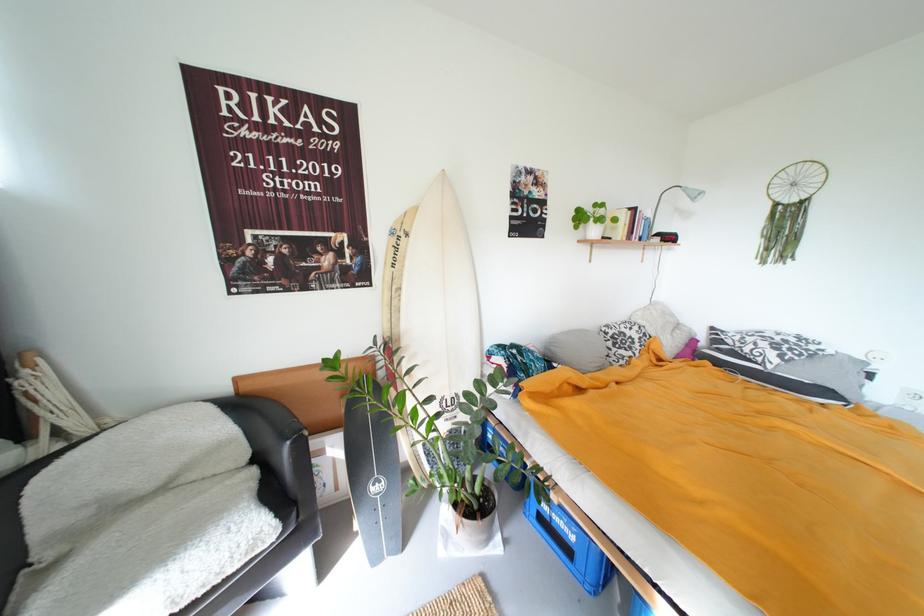
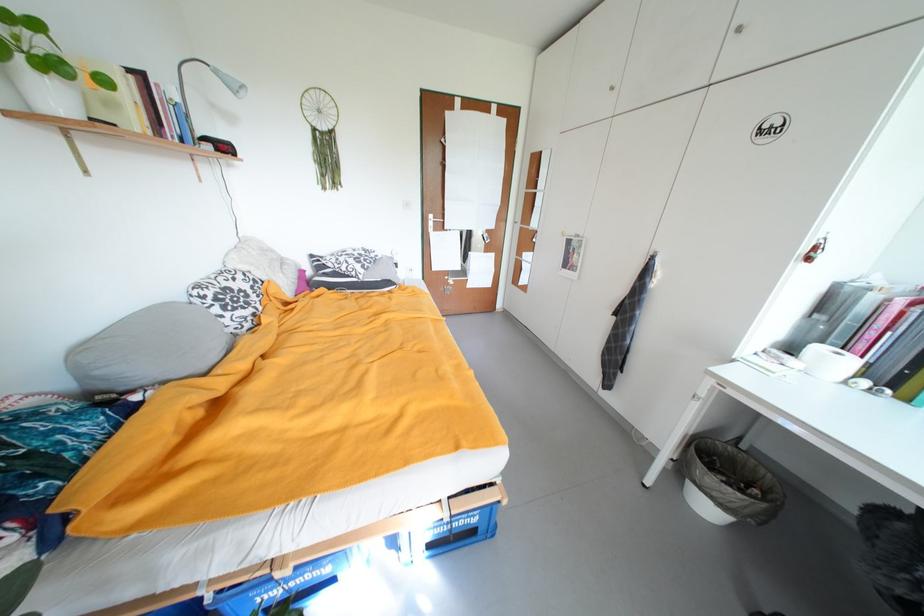
Locate, in the second image, the point that corresponds to the point at 614,334 in the first image.

(211, 299)